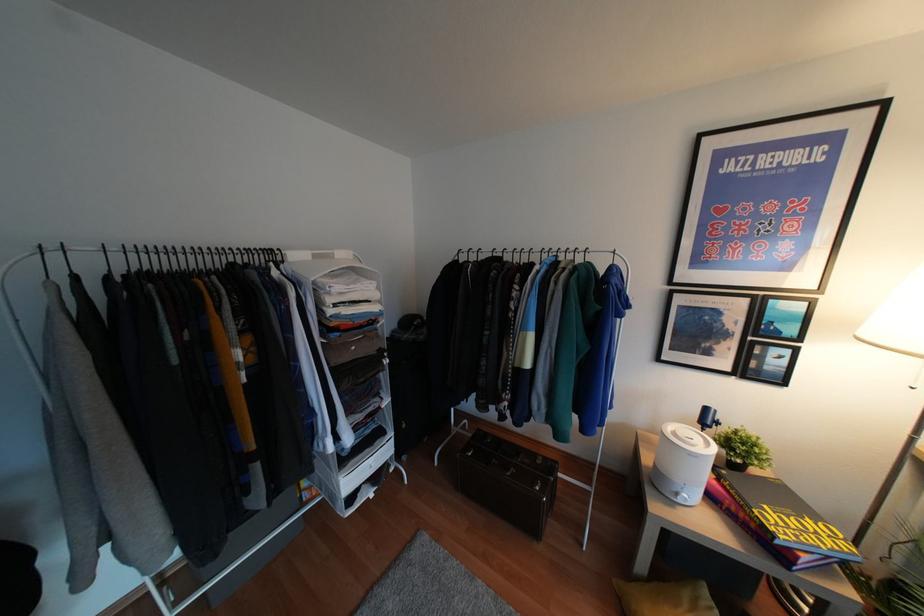
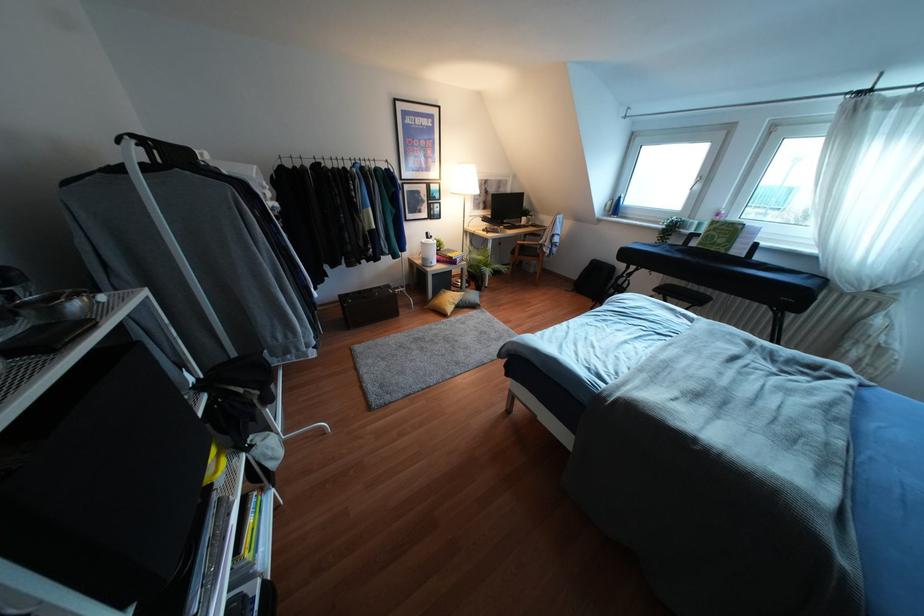
In the second image, find the point that corresponds to pixel 706 408 in the first image.

(427, 233)